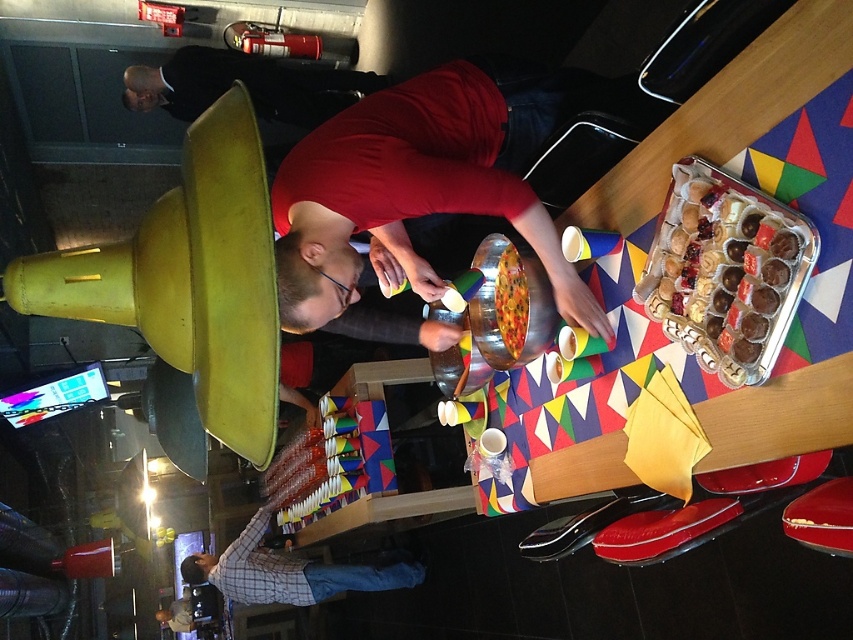
You are organizing a party and need to place a decorative centerpiece on the table. The table has a black suit jacket at upper left. Where should you place the centerpiece to avoid covering any existing items?

The black suit jacket at upper left is located at point (245, 84), so you should place the centerpiece away from that coordinate to avoid covering it.

You are organizing a small event and need to place a rectangular sign that is 1.2 meters wide between the black suit jacket at upper left and the plaid shirt at lower center. Based on their widths, will the sign fit between them?

The black suit jacket at upper left is narrower than the plaid shirt at lower center. Since the sign is 1.2 meters wide, it depends on the actual space between them, but the description only mentions their widths, not the distance between. Therefore, we cannot determine if the sign will fit based on the provided information.